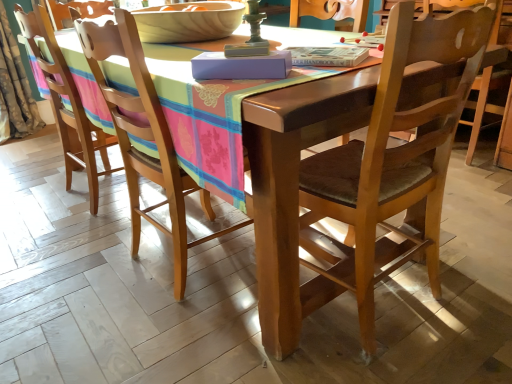
Question: Is wooden chair at center, which ranks as the 3th chair in right-to-left order, to the left of wooden chair at left, which is the second chair from right to left, from the viewer's perspective?

Choices:
 (A) no
 (B) yes

Answer: (B)

Question: From a real-world perspective, is wooden chair at center, positioned as the first chair in left-to-right order, positioned under wooden chair at left, which is the second chair from right to left, based on gravity?

Choices:
 (A) no
 (B) yes

Answer: (A)

Question: Are wooden chair at center, positioned as the first chair in left-to-right order, and wooden chair at left, which is the second chair from right to left, beside each other?

Choices:
 (A) yes
 (B) no

Answer: (B)

Question: Does wooden chair at center, which ranks as the 3th chair in right-to-left order, have a larger size compared to wooden chair at left, arranged as the second chair when viewed from the left?

Choices:
 (A) yes
 (B) no

Answer: (A)

Question: Can we say wooden chair at center, positioned as the first chair in left-to-right order, lies outside wooden chair at left, arranged as the second chair when viewed from the left?

Choices:
 (A) no
 (B) yes

Answer: (B)

Question: Is point (56, 92) closer or farther from the camera than point (308, 84)?

Choices:
 (A) farther
 (B) closer

Answer: (A)

Question: Considering the positions of wooden chair at center, positioned as the first chair in left-to-right order, and wooden chair at center, which is counted as the 1th chair, starting from the right, in the image, is wooden chair at center, positioned as the first chair in left-to-right order, wider or thinner than wooden chair at center, which is counted as the 1th chair, starting from the right,?

Choices:
 (A) thin
 (B) wide

Answer: (B)

Question: Considering their positions, is wooden chair at center, which ranks as the 3th chair in right-to-left order, located in front of or behind wooden chair at center, which is counted as the third chair, starting from the left?

Choices:
 (A) front
 (B) behind

Answer: (B)

Question: Do you think wooden chair at center, positioned as the first chair in left-to-right order, is within wooden chair at center, which is counted as the third chair, starting from the left, or outside of it?

Choices:
 (A) inside
 (B) outside

Answer: (B)

Question: Looking at the image, does wooden chair at center, positioned as the first chair in left-to-right order, seem bigger or smaller compared to wooden chair at left, arranged as the second chair when viewed from the left?

Choices:
 (A) big
 (B) small

Answer: (A)

Question: From a real-world perspective, is wooden chair at center, positioned as the first chair in left-to-right order, physically located above or below wooden chair at left, which is the second chair from right to left?

Choices:
 (A) below
 (B) above

Answer: (B)

Question: Is point (70, 188) closer or farther from the camera than point (92, 34)?

Choices:
 (A) farther
 (B) closer

Answer: (A)

Question: Which is correct: wooden chair at center, positioned as the first chair in left-to-right order, is inside wooden chair at left, which is the second chair from right to left, or outside of it?

Choices:
 (A) inside
 (B) outside

Answer: (B)

Question: Based on their positions, is wooden chair at center, which is counted as the third chair, starting from the left, located to the left or right of wooden chair at center, which ranks as the 3th chair in right-to-left order?

Choices:
 (A) right
 (B) left

Answer: (A)

Question: Is wooden chair at center, which is counted as the third chair, starting from the left, taller or shorter than wooden chair at center, positioned as the first chair in left-to-right order?

Choices:
 (A) tall
 (B) short

Answer: (B)